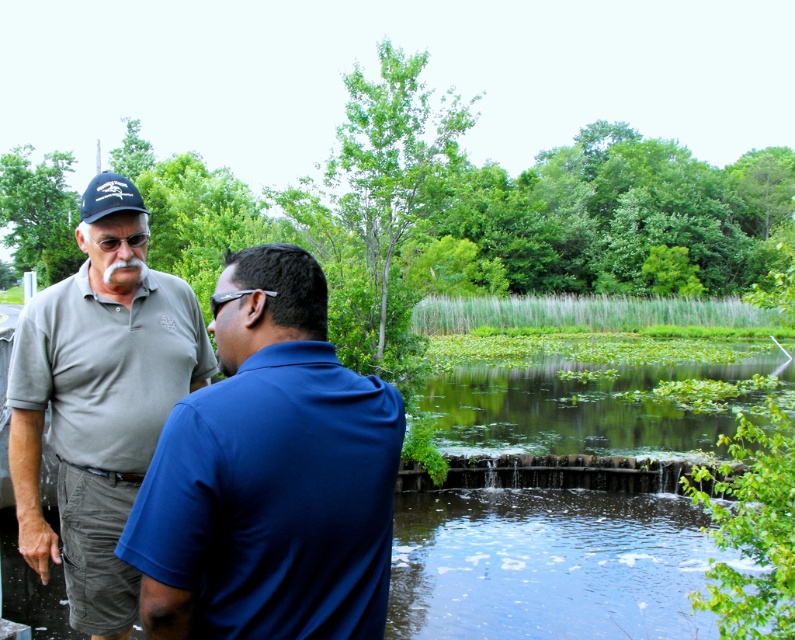
Does matte gray polo shirt at center come in front of matte black baseball cap at upper left?

That is True.

Does point (320, 340) come farther from viewer compared to point (83, 218)?

That is False.

Image resolution: width=795 pixels, height=640 pixels. I want to click on matte gray polo shirt at center, so click(x=270, y=476).

What do you see at coordinates (99, 408) in the screenshot? I see `gray cotton polo shirt at left` at bounding box center [99, 408].

Which of these two, gray cotton polo shirt at left or green leafy vegetation at lower center, stands taller?

gray cotton polo shirt at left

Who is more forward, (22, 394) or (625, 403)?

Point (22, 394) is in front.

The image size is (795, 640). Find the location of `gray cotton polo shirt at left`. gray cotton polo shirt at left is located at coordinates (99, 408).

Can you confirm if matte gray polo shirt at center is taller than green leafy vegetation at lower center?

In fact, matte gray polo shirt at center may be shorter than green leafy vegetation at lower center.

Between matte gray polo shirt at center and green leafy vegetation at lower center, which one is positioned lower?

green leafy vegetation at lower center is below.

Does point (335, 525) come farther from viewer compared to point (571, 429)?

No, it is not.

What are the coordinates of `matte gray polo shirt at center` in the screenshot? It's located at (270, 476).